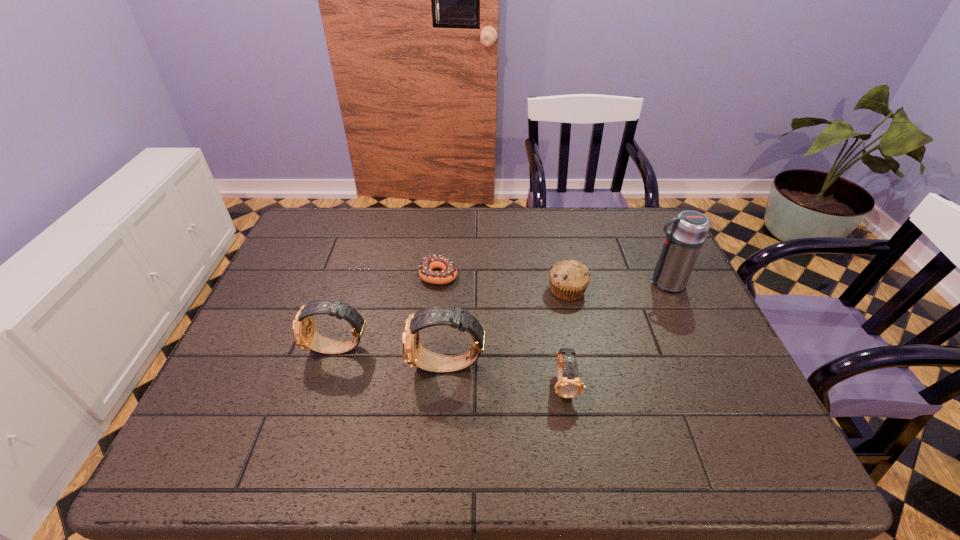
This screenshot has width=960, height=540. In the image, there is a desktop. Find the location of `free space at the far edge`. free space at the far edge is located at coordinates click(x=412, y=248).

Find the location of a particular element. free space at the near edge of the desktop is located at coordinates (528, 406).

Where is `blank area at the left edge`? The width and height of the screenshot is (960, 540). blank area at the left edge is located at coordinates point(287,266).

In the image, there is a desktop. Where is `vacant area at the far left corner`? The width and height of the screenshot is (960, 540). vacant area at the far left corner is located at coordinates (343, 230).

The width and height of the screenshot is (960, 540). I want to click on vacant space at the far right corner, so click(623, 214).

The width and height of the screenshot is (960, 540). I want to click on vacant area that lies between the second watch from right to left and the tallest object, so pos(557,325).

You are a GUI agent. You are given a task and a screenshot of the screen. Output one action in this format:
    pyautogui.click(x=<x>, y=<y>)
    Task: Click on the free spot between the second watch from right to left and the fourth shortest object
    The image size is (960, 540).
    Given the screenshot: What is the action you would take?
    pyautogui.click(x=393, y=358)

This screenshot has height=540, width=960. What are the coordinates of `free point between the second watch from left to right and the muffin` in the screenshot? It's located at (507, 328).

Locate an element on the screen. blank region between the leftmost object and the rightmost object is located at coordinates (502, 316).

Find the location of a particular element. This screenshot has width=960, height=540. vacant space in between the muffin and the doughnut is located at coordinates (503, 282).